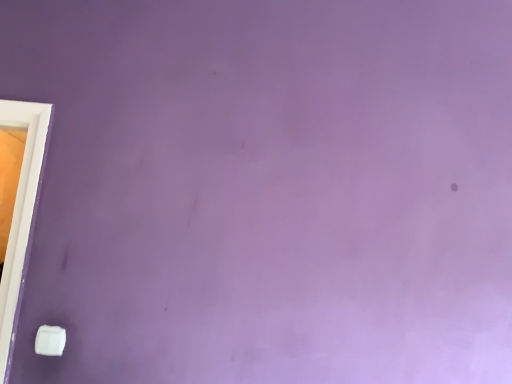
Measure the distance between white plastic door handle at lower left and camera.

A distance of 4.29 feet exists between white plastic door handle at lower left and camera.

Measure the distance between point (49, 353) and camera.

A distance of 4.29 feet exists between point (49, 353) and camera.

The width and height of the screenshot is (512, 384). What do you see at coordinates (50, 340) in the screenshot? I see `white plastic door handle at lower left` at bounding box center [50, 340].

You are a GUI agent. You are given a task and a screenshot of the screen. Output one action in this format:
    pyautogui.click(x=<x>, y=<y>)
    Task: Click on the white plastic door handle at lower left
    The height and width of the screenshot is (384, 512).
    Given the screenshot: What is the action you would take?
    pyautogui.click(x=50, y=340)

The width and height of the screenshot is (512, 384). Find the location of `white plastic door handle at lower left`. white plastic door handle at lower left is located at coordinates (50, 340).